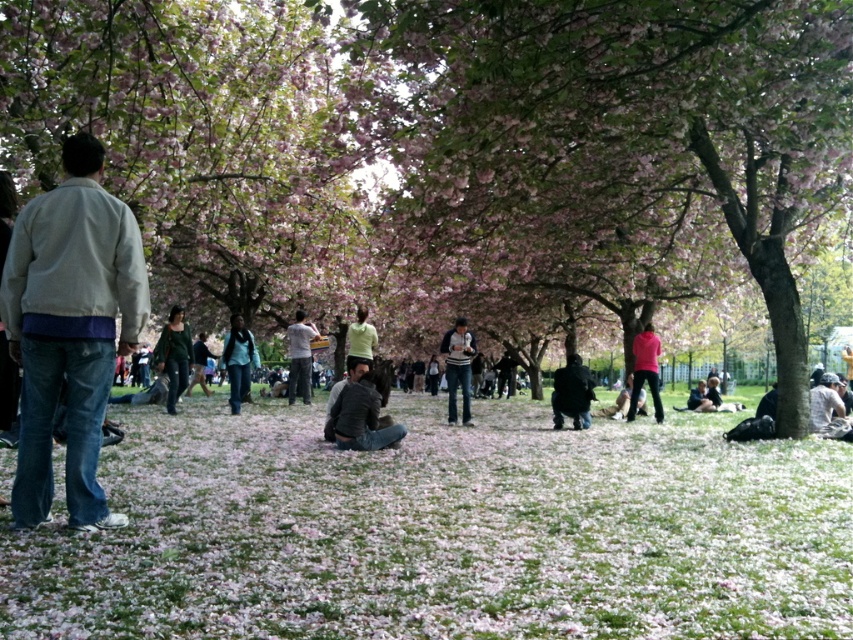
Question: Which is nearer to the green matte shirt at center?

Choices:
 (A) dark gray sweater at center
 (B) pink blossoms at center
 (C) dark green fabric jacket at center
 (D) light gray denim jacket at left

Answer: (A)

Question: Is dark gray fabric jacket at center thinner than dark gray jacket at center?

Choices:
 (A) no
 (B) yes

Answer: (A)

Question: Can you confirm if pink matte flower at center is positioned below pink matte jacket at center-right?

Choices:
 (A) yes
 (B) no

Answer: (A)

Question: Does light gray sweater at center have a larger size compared to green matte shirt at center?

Choices:
 (A) yes
 (B) no

Answer: (B)

Question: Which of the following is the farthest from the observer?

Choices:
 (A) (846, 428)
 (B) (183, 339)
 (C) (230, 369)

Answer: (C)

Question: Which object is farther from the camera taking this photo?

Choices:
 (A) dark gray jacket at center
 (B) light gray sweater at center
 (C) pink blossoms at center

Answer: (A)